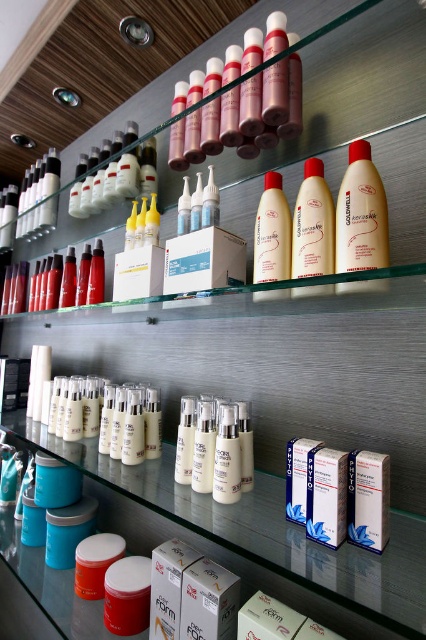
Question: Can you confirm if translucent amber bottle at center is bigger than blue cardboard box at center?

Choices:
 (A) yes
 (B) no

Answer: (A)

Question: In this image, where is matte beige lotion at center located relative to matte cream bottle at center?

Choices:
 (A) above
 (B) below

Answer: (A)

Question: In this image, where is matte pink tubes at upper center located relative to translucent amber bottle at center?

Choices:
 (A) below
 (B) above

Answer: (B)

Question: Which object is the farthest from the matte pink tubes at upper center?

Choices:
 (A) blue cardboard box at center
 (B) white glossy bottles at lower center

Answer: (B)

Question: Which object is positioned closest to the blue cardboard box at center?

Choices:
 (A) matte pink tubes at upper center
 (B) translucent amber bottle at center
 (C) white glossy bottles at lower center
 (D) matte cream bottle at center

Answer: (D)

Question: Which point is closer to the camera?

Choices:
 (A) (317, 252)
 (B) (353, 502)
 (C) (354, 156)
 (D) (305, 520)

Answer: (B)